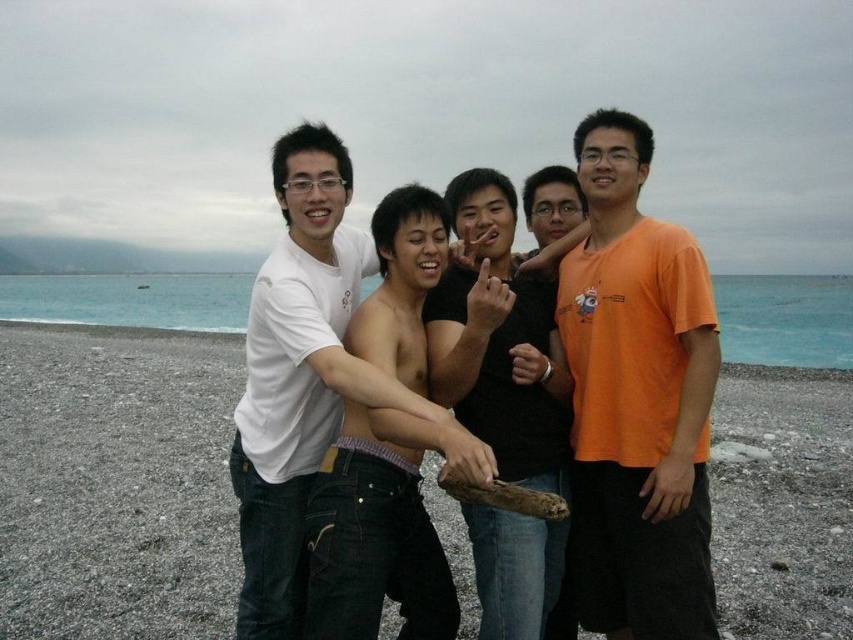
Who is lower down, smooth sand at center or orange cotton t-shirt at center?

smooth sand at center is lower down.

Find the location of `smooth sand at center`. smooth sand at center is located at coordinates 115,483.

This screenshot has height=640, width=853. What are the coordinates of `smooth sand at center` in the screenshot? It's located at (115, 483).

Find the location of `smooth sand at center`. smooth sand at center is located at coordinates tap(115, 483).

You are a GUI agent. You are given a task and a screenshot of the screen. Output one action in this format:
    pyautogui.click(x=<x>, y=<y>)
    Task: Click on the smooth sand at center
    The image size is (853, 640).
    Given the screenshot: What is the action you would take?
    click(x=115, y=483)

Locate an element on the screen. smooth sand at center is located at coordinates (115, 483).

From the picture: Is shiny black shirt at center bigger than white cotton shirt at center?

No.

Which is behind, point (444, 388) or point (334, 176)?

Positioned behind is point (334, 176).

This screenshot has width=853, height=640. Find the location of `shiny black shirt at center`. shiny black shirt at center is located at coordinates (498, 339).